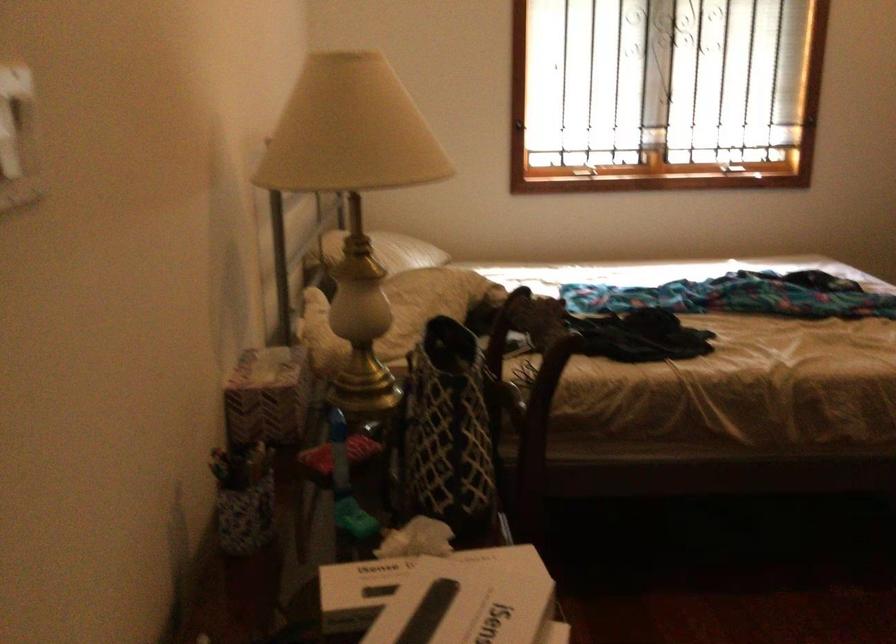
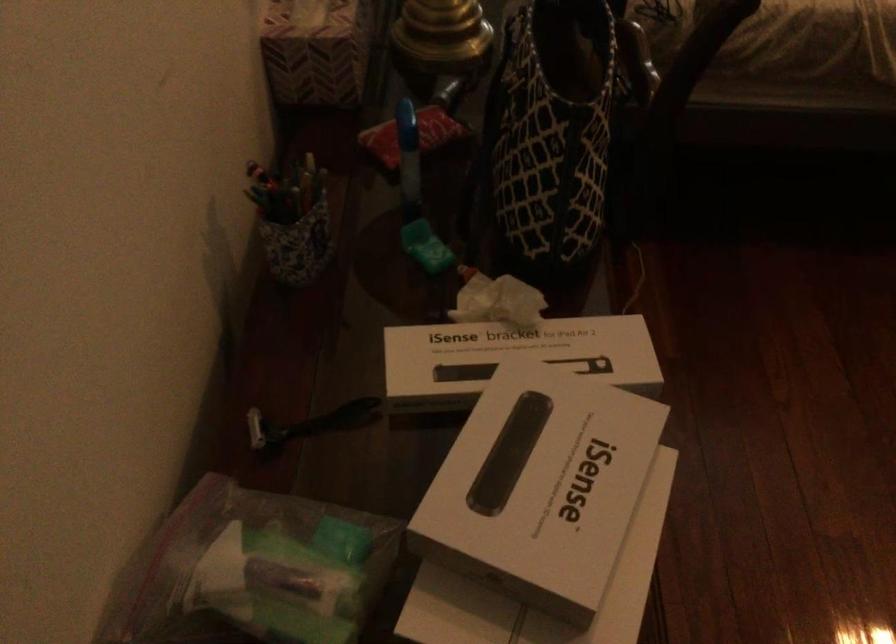
The point at (x=264, y=401) is marked in the first image. Where is the corresponding point in the second image?

(315, 51)